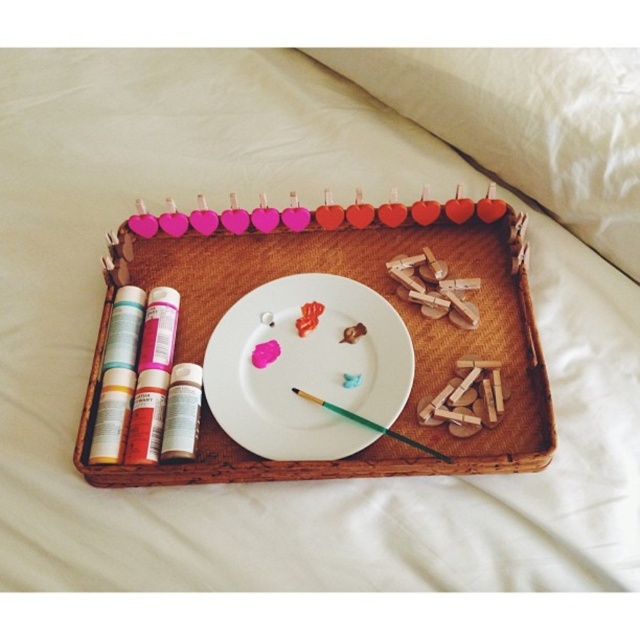
Question: Does woven wood tray at center appear under white matte paper plate at center?

Choices:
 (A) yes
 (B) no

Answer: (B)

Question: Is woven wood tray at center bigger than green wood paint brush at center?

Choices:
 (A) yes
 (B) no

Answer: (A)

Question: Is woven wood tray at center to the left of white matte paper plate at center from the viewer's perspective?

Choices:
 (A) no
 (B) yes

Answer: (A)

Question: Which object appears closest to the camera in this image?

Choices:
 (A) white matte paper plate at center
 (B) woven wood tray at center
 (C) green wood paint brush at center

Answer: (B)

Question: Among these objects, which one is nearest to the camera?

Choices:
 (A) white matte paper plate at center
 (B) woven wood tray at center
 (C) green wood paint brush at center

Answer: (B)

Question: Based on their relative distances, which object is nearer to the green wood paint brush at center?

Choices:
 (A) white matte paper plate at center
 (B) woven wood tray at center

Answer: (A)